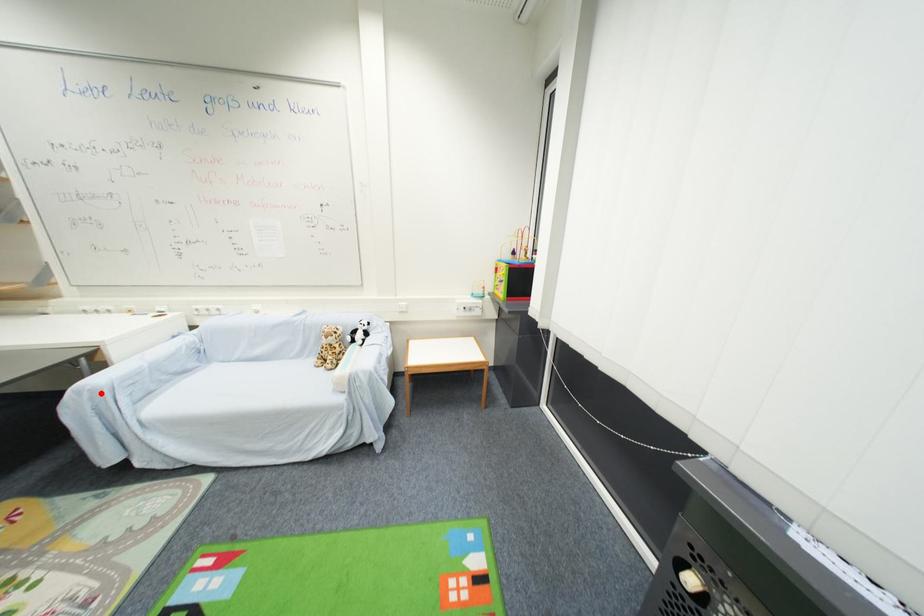
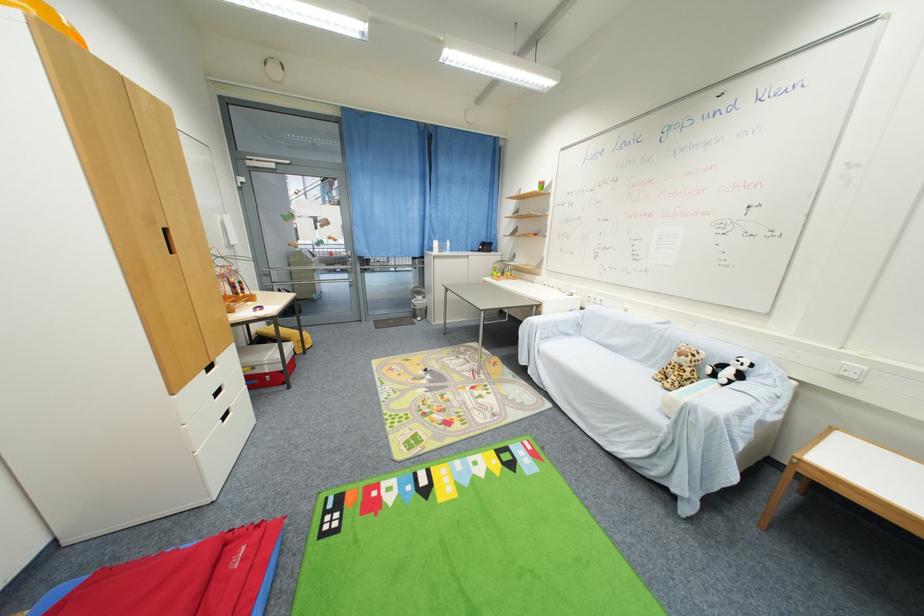
The point at the highlighted location is marked in the first image. Where is the corresponding point in the second image?

(537, 326)